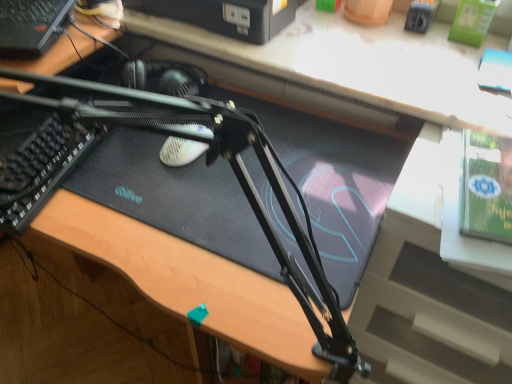
Question: Is black matte computer desk at center oriented away from green matte paperback book at upper right?

Choices:
 (A) yes
 (B) no

Answer: (B)

Question: Would you say black matte computer desk at center is outside green matte paperback book at upper right?

Choices:
 (A) yes
 (B) no

Answer: (A)

Question: From a real-world perspective, is black matte computer desk at center physically above green matte paperback book at upper right?

Choices:
 (A) yes
 (B) no

Answer: (B)

Question: Does black matte computer desk at center have a larger size compared to green matte paperback book at upper right?

Choices:
 (A) yes
 (B) no

Answer: (A)

Question: Considering the relative positions of black matte computer desk at center and green matte paperback book at upper right in the image provided, is black matte computer desk at center behind green matte paperback book at upper right?

Choices:
 (A) no
 (B) yes

Answer: (B)

Question: Is black plastic printer at upper center, the first computer positioned from the right, wider or thinner than black matte computer desk at center?

Choices:
 (A) wide
 (B) thin

Answer: (B)

Question: Is point (244, 3) positioned closer to the camera than point (289, 69)?

Choices:
 (A) farther
 (B) closer

Answer: (A)

Question: Considering the relative positions of black plastic printer at upper center, the first computer positioned from the right, and black matte computer desk at center in the image provided, is black plastic printer at upper center, the first computer positioned from the right, to the left or to the right of black matte computer desk at center?

Choices:
 (A) right
 (B) left

Answer: (B)

Question: Is black plastic printer at upper center, acting as the 2th computer starting from the left, in front of or behind black matte computer desk at center in the image?

Choices:
 (A) front
 (B) behind

Answer: (B)

Question: Is black matte computer desk at center to the left or to the right of black plastic computer at upper left, the 1th computer in the left-to-right sequence, in the image?

Choices:
 (A) right
 (B) left

Answer: (A)

Question: From a real-world perspective, is black matte computer desk at center physically located above or below black plastic computer at upper left, the 1th computer in the left-to-right sequence?

Choices:
 (A) below
 (B) above

Answer: (A)

Question: From the image's perspective, is black matte computer desk at center located above or below black plastic computer at upper left, arranged as the second computer when viewed from the right?

Choices:
 (A) above
 (B) below

Answer: (A)

Question: In terms of width, does black matte computer desk at center look wider or thinner when compared to black plastic computer at upper left, arranged as the second computer when viewed from the right?

Choices:
 (A) wide
 (B) thin

Answer: (A)

Question: In terms of height, does black plastic computer at upper left, arranged as the second computer when viewed from the right, look taller or shorter compared to black textured keyboard at left?

Choices:
 (A) tall
 (B) short

Answer: (A)

Question: Relative to black textured keyboard at left, is black plastic computer at upper left, arranged as the second computer when viewed from the right, in front or behind?

Choices:
 (A) behind
 (B) front

Answer: (A)